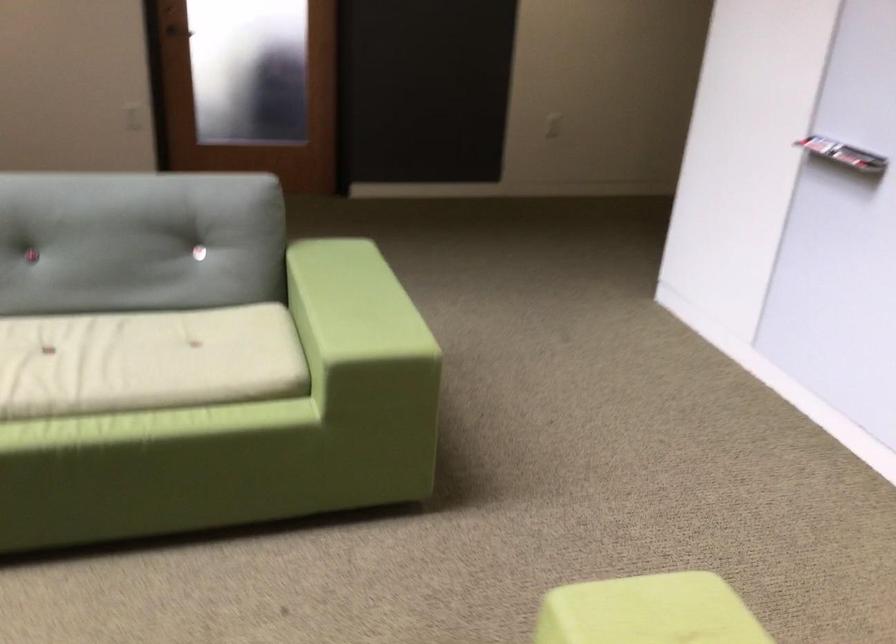
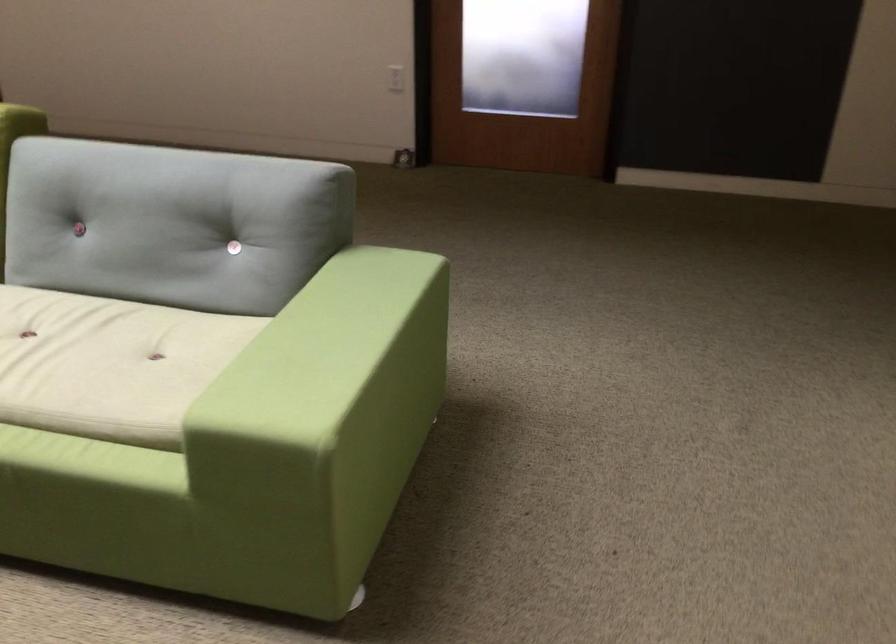
Locate, in the second image, the point that corresponds to point 167,354 in the first image.

(109, 364)